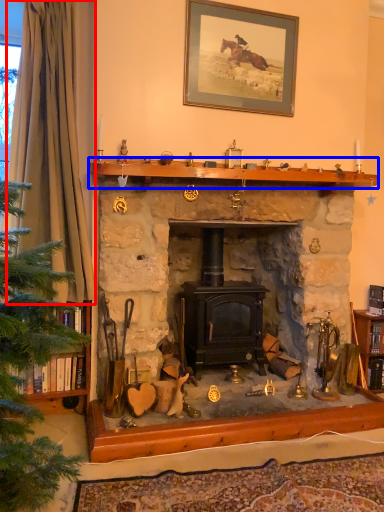
Question: Which object is closer to the camera taking this photo, curtain (highlighted by a red box) or mantle (highlighted by a blue box)?

Choices:
 (A) curtain
 (B) mantle

Answer: (A)